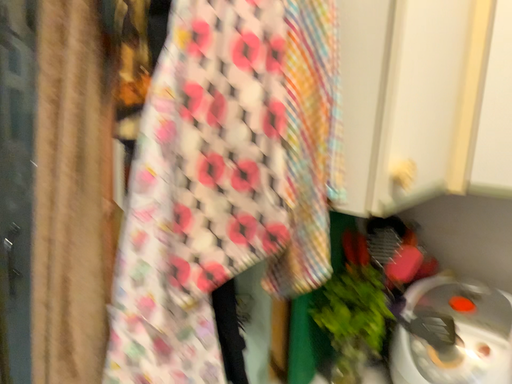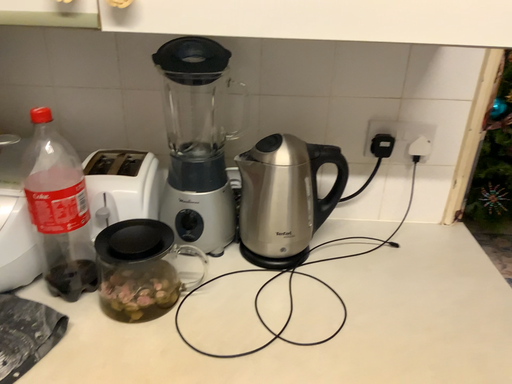
Question: How did the camera likely rotate when shooting the video?

Choices:
 (A) rotated right
 (B) rotated left

Answer: (A)